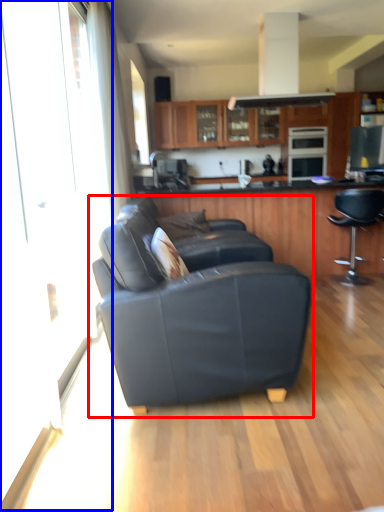
Question: Among these objects, which one is nearest to the camera, studio couch (highlighted by a red box) or screen door (highlighted by a blue box)?

Choices:
 (A) studio couch
 (B) screen door

Answer: (B)